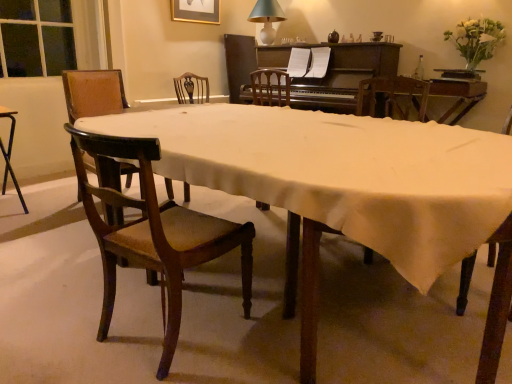
Question: Considering the relative sizes of black metal desk at left and mahogany wood chair at lower left, the second chair from the left, in the image provided, is black metal desk at left shorter than mahogany wood chair at lower left, the second chair from the left,?

Choices:
 (A) no
 (B) yes

Answer: (B)

Question: Is black metal desk at left positioned beyond the bounds of mahogany wood chair at lower left, the second chair from the left?

Choices:
 (A) no
 (B) yes

Answer: (B)

Question: From a real-world perspective, is black metal desk at left over mahogany wood chair at lower left, positioned as the 1th chair in right-to-left order?

Choices:
 (A) no
 (B) yes

Answer: (A)

Question: From the image's perspective, does black metal desk at left appear lower than mahogany wood chair at lower left, positioned as the 1th chair in right-to-left order?

Choices:
 (A) no
 (B) yes

Answer: (A)

Question: Considering the relative sizes of black metal desk at left and mahogany wood chair at lower left, positioned as the 1th chair in right-to-left order, in the image provided, is black metal desk at left thinner than mahogany wood chair at lower left, positioned as the 1th chair in right-to-left order,?

Choices:
 (A) no
 (B) yes

Answer: (A)

Question: Is wooden chair at left, placed as the first chair when sorted from back to front, in front of or behind wooden table at center in the image?

Choices:
 (A) front
 (B) behind

Answer: (B)

Question: Is point (64, 76) positioned closer to the camera than point (385, 231)?

Choices:
 (A) farther
 (B) closer

Answer: (A)

Question: Considering the positions of wooden chair at left, which appears as the second chair when viewed from the right, and wooden table at center in the image, is wooden chair at left, which appears as the second chair when viewed from the right, bigger or smaller than wooden table at center?

Choices:
 (A) big
 (B) small

Answer: (B)

Question: Do you think wooden chair at left, which is counted as the 1th chair, starting from the left, is within wooden table at center, or outside of it?

Choices:
 (A) inside
 (B) outside

Answer: (B)

Question: From the image's perspective, is wooden chair at left, which appears as the second chair when viewed from the right, above or below white matte flowers at upper right?

Choices:
 (A) above
 (B) below

Answer: (B)

Question: In the image, is wooden chair at left, which appears as the second chair when viewed from the right, positioned in front of or behind white matte flowers at upper right?

Choices:
 (A) behind
 (B) front

Answer: (B)

Question: Is wooden chair at left, which is counted as the 1th chair, starting from the left, bigger or smaller than white matte flowers at upper right?

Choices:
 (A) big
 (B) small

Answer: (A)

Question: Visually, is wooden chair at left, placed as the first chair when sorted from back to front, positioned to the left or to the right of white matte flowers at upper right?

Choices:
 (A) right
 (B) left

Answer: (B)

Question: Is mahogany wood chair at lower left, the first chair viewed from the front, inside the boundaries of black metal desk at left, or outside?

Choices:
 (A) outside
 (B) inside

Answer: (A)

Question: Considering their positions, is mahogany wood chair at lower left, the first chair viewed from the front, located in front of or behind black metal desk at left?

Choices:
 (A) behind
 (B) front

Answer: (B)